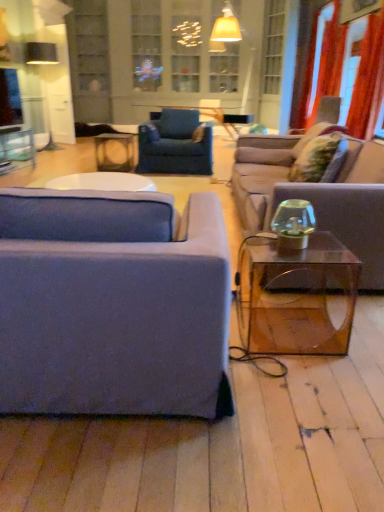
This screenshot has height=512, width=384. In order to click on matte blue fabric couch at left, the second studio couch in the back-to-front sequence in this screenshot , I will do `click(113, 304)`.

The height and width of the screenshot is (512, 384). What do you see at coordinates (113, 304) in the screenshot?
I see `matte blue fabric couch at left, the second studio couch in the back-to-front sequence` at bounding box center [113, 304].

What do you see at coordinates (10, 98) in the screenshot? I see `transparent glass window screen at upper left` at bounding box center [10, 98].

The height and width of the screenshot is (512, 384). What do you see at coordinates (175, 144) in the screenshot?
I see `velvet blue armchair at center` at bounding box center [175, 144].

Measure the distance between point (x=140, y=63) and camera.

Point (x=140, y=63) and camera are 6.35 meters apart.

In order to click on transparent glass studio couch at right, which ranks as the 1th studio couch in right-to-left order in this screenshot , I will do `click(357, 209)`.

Is transparent glass window screen at upper left spatially inside orange fabric curtain at upper right, marked as the first curtain in a front-to-back arrangement, or outside of it?

transparent glass window screen at upper left cannot be found inside orange fabric curtain at upper right, marked as the first curtain in a front-to-back arrangement.

Is orange fabric curtain at upper right, arranged as the second curtain when viewed from the back, at the back of transparent glass window screen at upper left?

No, transparent glass window screen at upper left's orientation is not away from orange fabric curtain at upper right, arranged as the second curtain when viewed from the back.

Does transparent glass window screen at upper left touch orange fabric curtain at upper right, arranged as the second curtain when viewed from the back?

No, transparent glass window screen at upper left is not in contact with orange fabric curtain at upper right, arranged as the second curtain when viewed from the back.

From their relative heights in the image, would you say transparent glass window screen at upper left is taller or shorter than orange fabric curtain at upper right, arranged as the second curtain when viewed from the back?

Considering their sizes, transparent glass window screen at upper left has less height than orange fabric curtain at upper right, arranged as the second curtain when viewed from the back.

Between clear glass table at upper left, which appears as the second table when viewed from the right, and orange fabric curtain at upper right, arranged as the second curtain when viewed from the back, which one has smaller width?

orange fabric curtain at upper right, arranged as the second curtain when viewed from the back, is thinner.

From the image's perspective, which is above, clear glass table at upper left, which appears as the second table when viewed from the right, or orange fabric curtain at upper right, arranged as the second curtain when viewed from the back?

orange fabric curtain at upper right, arranged as the second curtain when viewed from the back, is shown above in the image.

Is point (34, 165) closer or farther from the camera than point (378, 69)?

Clearly, point (34, 165) is more distant from the camera than point (378, 69).

Can you confirm if clear glass table at upper left, acting as the 1th table starting from the left, is positioned to the left of orange fabric curtain at upper right, arranged as the second curtain when viewed from the back?

Correct, you'll find clear glass table at upper left, acting as the 1th table starting from the left, to the left of orange fabric curtain at upper right, arranged as the second curtain when viewed from the back.

From a real-world perspective, is orange fabric curtain at upper right, arranged as the second curtain when viewed from the back, physically below black fabric lampshade at upper left?

Actually, orange fabric curtain at upper right, arranged as the second curtain when viewed from the back, is physically above black fabric lampshade at upper left in the real world.

Considering the sizes of objects orange fabric curtain at upper right, arranged as the second curtain when viewed from the back, and black fabric lampshade at upper left in the image provided, who is taller, orange fabric curtain at upper right, arranged as the second curtain when viewed from the back, or black fabric lampshade at upper left?

orange fabric curtain at upper right, arranged as the second curtain when viewed from the back.

From the image's perspective, relative to black fabric lampshade at upper left, is orange fabric curtain at upper right, marked as the first curtain in a front-to-back arrangement, above or below?

Clearly, from the image's perspective, orange fabric curtain at upper right, marked as the first curtain in a front-to-back arrangement, is below black fabric lampshade at upper left.

Can you confirm if velvet blue armchair at center is wider than matte blue fabric couch at left, placed as the first studio couch when sorted from front to back?

No.

From the image's perspective, would you say velvet blue armchair at center is shown under matte blue fabric couch at left, the second studio couch in the back-to-front sequence?

No.

From a real-world perspective, is velvet blue armchair at center above or below matte blue fabric couch at left, the second studio couch in the back-to-front sequence?

In terms of real-world spatial position, velvet blue armchair at center is above matte blue fabric couch at left, the second studio couch in the back-to-front sequence.

Can you confirm if velvet blue armchair at center is bigger than matte blue fabric couch at left, placed as the 2th studio couch when sorted from right to left?

Incorrect, velvet blue armchair at center is not larger than matte blue fabric couch at left, placed as the 2th studio couch when sorted from right to left.

Consider the image. Considering the relative sizes of transparent acrylic coffee table at right and red velvet curtain at upper right, acting as the first curtain starting from the back, in the image provided, is transparent acrylic coffee table at right thinner than red velvet curtain at upper right, acting as the first curtain starting from the back,?

Incorrect, the width of transparent acrylic coffee table at right is not less than that of red velvet curtain at upper right, acting as the first curtain starting from the back.

Image resolution: width=384 pixels, height=512 pixels. What are the coordinates of `coffee table in front of the red velvet curtain at upper right, acting as the first curtain starting from the back` in the screenshot? It's located at (296, 296).

Can you confirm if transparent acrylic coffee table at right is positioned to the left of red velvet curtain at upper right, acting as the first curtain starting from the back?

Yes, transparent acrylic coffee table at right is to the left of red velvet curtain at upper right, acting as the first curtain starting from the back.

Based on the photo, which of these two, transparent glass studio couch at right, which appears as the first studio couch when viewed from the back, or clear glass cabinet at upper center, is wider?

Wider between the two is transparent glass studio couch at right, which appears as the first studio couch when viewed from the back.

The image size is (384, 512). I want to click on window behind the transparent glass studio couch at right, which appears as the first studio couch when viewed from the back, so click(186, 45).

Considering the relative sizes of transparent glass studio couch at right, which ranks as the 1th studio couch in right-to-left order, and clear glass cabinet at upper center in the image provided, is transparent glass studio couch at right, which ranks as the 1th studio couch in right-to-left order, taller than clear glass cabinet at upper center?

Incorrect, the height of transparent glass studio couch at right, which ranks as the 1th studio couch in right-to-left order, is not larger of that of clear glass cabinet at upper center.

Is point (347, 188) closer or farther from the camera than point (157, 48)?

Point (347, 188) is positioned closer to the camera compared to point (157, 48).

Considering the positions of objects clear glass table at upper left, acting as the 1th table starting from the left, and red velvet curtain at upper right, marked as the second curtain in a front-to-back arrangement, in the image provided, who is more to the right, clear glass table at upper left, acting as the 1th table starting from the left, or red velvet curtain at upper right, marked as the second curtain in a front-to-back arrangement,?

From the viewer's perspective, red velvet curtain at upper right, marked as the second curtain in a front-to-back arrangement, appears more on the right side.

From a real-world perspective, which is physically above, clear glass table at upper left, which appears as the second table when viewed from the right, or red velvet curtain at upper right, marked as the second curtain in a front-to-back arrangement?

red velvet curtain at upper right, marked as the second curtain in a front-to-back arrangement, is physically above.

Which is farther, (14,150) or (314,106)?

The point (314,106) is farther.

Based on the photo, is clear glass table at upper left, acting as the 1th table starting from the left, directly adjacent to red velvet curtain at upper right, acting as the first curtain starting from the back?

No, clear glass table at upper left, acting as the 1th table starting from the left, is not touching red velvet curtain at upper right, acting as the first curtain starting from the back.

Identify the location of window screen on the left of orange fabric curtain at upper right, marked as the first curtain in a front-to-back arrangement. (10, 98).

Find the location of a particular element. The image size is (384, 512). the 1st table located beneath the orange fabric curtain at upper right, arranged as the second curtain when viewed from the back (from a real-world perspective) is located at coordinates (18, 146).

Based on their spatial positions, is black fabric lampshade at upper left or transparent glass studio couch at right, which appears as the first studio couch when viewed from the back, closer to orange fabric curtain at upper right, marked as the first curtain in a front-to-back arrangement?

transparent glass studio couch at right, which appears as the first studio couch when viewed from the back, lies closer to orange fabric curtain at upper right, marked as the first curtain in a front-to-back arrangement, than the other object.

Considering their positions, is clear glass cabinet at upper center positioned further to transparent acrylic coffee table at right than clear glass table at upper left, acting as the 1th table starting from the left?

clear glass cabinet at upper center is positioned further to the anchor transparent acrylic coffee table at right.

Looking at the image, which one is located closer to clear glass table at upper left, acting as the 1th table starting from the left, matte glass table at center, arranged as the 2th table when viewed from the left, or black fabric lampshade at upper left?

matte glass table at center, arranged as the 2th table when viewed from the left, lies closer to clear glass table at upper left, acting as the 1th table starting from the left, than the other object.

Considering their positions, is matte blue fabric couch at left, placed as the first studio couch when sorted from front to back, positioned further to transparent glass studio couch at right, which is the second studio couch from left to right, than velvet blue armchair at center?

The object further to transparent glass studio couch at right, which is the second studio couch from left to right, is matte blue fabric couch at left, placed as the first studio couch when sorted from front to back.

Looking at the image, which one is located closer to transparent glass window screen at upper left, red velvet curtain at upper right, acting as the first curtain starting from the back, or matte blue fabric couch at left, placed as the first studio couch when sorted from front to back?

The object closer to transparent glass window screen at upper left is red velvet curtain at upper right, acting as the first curtain starting from the back.

Which object lies further to the anchor point matte blue fabric couch at left, placed as the first studio couch when sorted from front to back, velvet blue armchair at center or matte glass table at center, arranged as the 2th table when viewed from the left?

Based on the image, matte glass table at center, arranged as the 2th table when viewed from the left, appears to be further to matte blue fabric couch at left, placed as the first studio couch when sorted from front to back.

From the image, which object appears to be farther from red velvet curtain at upper right, marked as the second curtain in a front-to-back arrangement, orange fabric curtain at upper right, arranged as the second curtain when viewed from the back, or clear glass table at upper left, acting as the 1th table starting from the left?

Based on the image, clear glass table at upper left, acting as the 1th table starting from the left, appears to be further to red velvet curtain at upper right, marked as the second curtain in a front-to-back arrangement.

Based on the photo, considering their positions, is velvet blue armchair at center positioned closer to clear glass table at upper left, which appears as the second table when viewed from the right, than black fabric lampshade at upper left?

velvet blue armchair at center is positioned closer to the anchor clear glass table at upper left, which appears as the second table when viewed from the right.

At what (x,y) coordinates should I click in order to perform the action: click on window screen positioned between transparent acrylic coffee table at right and matte glass table at center, arranged as the 2th table when viewed from the left, from near to far. Please return your answer as a coordinate pair (x, y). This screenshot has width=384, height=512. Looking at the image, I should click on (10, 98).

The image size is (384, 512). I want to click on coffee table between matte blue fabric couch at left, the second studio couch in the back-to-front sequence, and matte glass table at center, positioned as the first table in right-to-left order, in the front-back direction, so click(296, 296).

The height and width of the screenshot is (512, 384). Find the location of `window located between black fabric lampshade at upper left and red velvet curtain at upper right, marked as the second curtain in a front-to-back arrangement, in the left-right direction`. window located between black fabric lampshade at upper left and red velvet curtain at upper right, marked as the second curtain in a front-to-back arrangement, in the left-right direction is located at coordinates (186, 45).

Identify the location of window screen between black fabric lampshade at upper left and red velvet curtain at upper right, marked as the second curtain in a front-to-back arrangement. Image resolution: width=384 pixels, height=512 pixels. (10, 98).